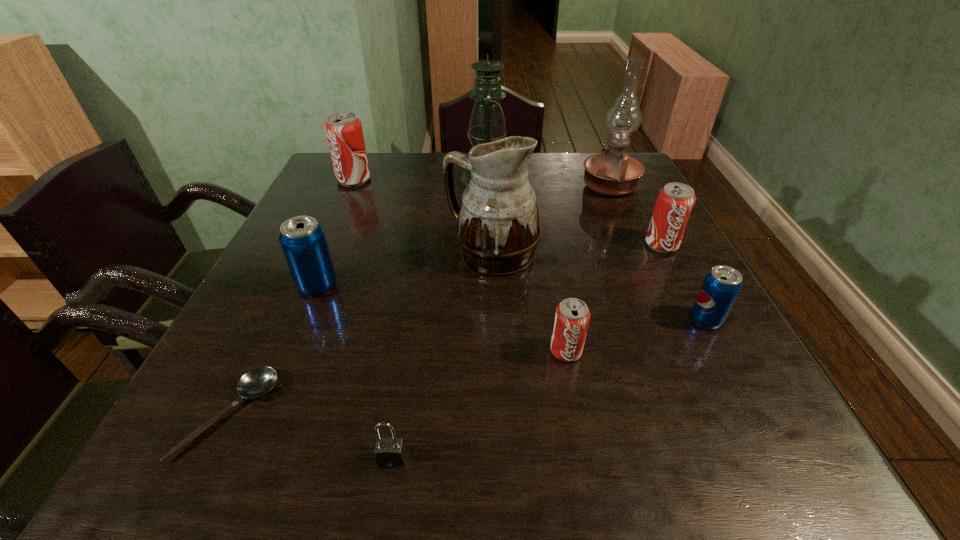
Locate an element on the screen. The height and width of the screenshot is (540, 960). the third closest soda can to the right oil lamp is located at coordinates (x=572, y=316).

Where is `soda can that is the third closest to the shortest object`? This screenshot has height=540, width=960. soda can that is the third closest to the shortest object is located at coordinates (344, 134).

Select which pink soda can appears as the second closest to the left oil lamp. Please provide its 2D coordinates. Your answer should be formatted as a tuple, i.e. [(x, y)], where the tuple contains the x and y coordinates of a point satisfying the conditions above.

[(675, 201)]

Identify the location of the second closest pink soda can to the second farthest soda can. (344, 134).